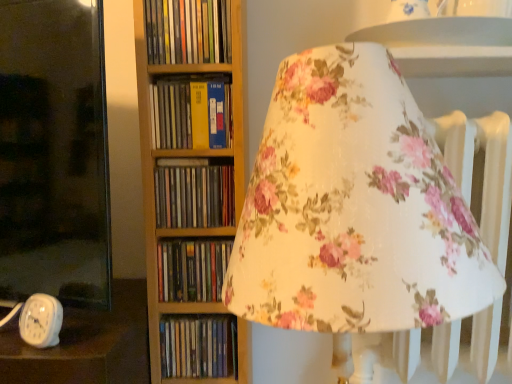
This screenshot has height=384, width=512. Identify the location of matte black book at center, positioned as the fourth book in top-to-bottom order. (192, 270).

Measure the distance between point (170, 284) and camera.

87.70 centimeters.

The image size is (512, 384). In order to click on brown cardboard book at center, which is the 3th book in top-to-bottom order in this screenshot , I will do `click(194, 196)`.

How much space does matte plastic books at center, arranged as the 1th book when ordered from the bottom, occupy vertically?

matte plastic books at center, arranged as the 1th book when ordered from the bottom, is 5.32 inches in height.

At what (x,y) coordinates should I click in order to perform the action: click on matte black book at center, positioned as the fourth book in top-to-bottom order. Please return your answer as a coordinate pair (x, y). This screenshot has width=512, height=384. Looking at the image, I should click on (192, 270).

From the image's perspective, does hardcover books at center, marked as the first book in a top-to-bottom arrangement, appear lower than yellow matte book at center, placed as the fourth book when sorted from bottom to top?

Actually, hardcover books at center, marked as the first book in a top-to-bottom arrangement, appears above yellow matte book at center, placed as the fourth book when sorted from bottom to top, in the image.

Considering the relative positions of hardcover books at center, marked as the first book in a top-to-bottom arrangement, and yellow matte book at center, placed as the fourth book when sorted from bottom to top, in the image provided, is hardcover books at center, marked as the first book in a top-to-bottom arrangement, behind yellow matte book at center, placed as the fourth book when sorted from bottom to top,?

No, it is not.

From a real-world perspective, is hardcover books at center, placed as the fifth book when sorted from bottom to top, physically above yellow matte book at center, which is the 2th book in top-to-bottom order?

Yes, from a real-world perspective, hardcover books at center, placed as the fifth book when sorted from bottom to top, is on top of yellow matte book at center, which is the 2th book in top-to-bottom order.

Considering the sizes of objects hardcover books at center, placed as the fifth book when sorted from bottom to top, and yellow matte book at center, placed as the fourth book when sorted from bottom to top, in the image provided, who is bigger, hardcover books at center, placed as the fifth book when sorted from bottom to top, or yellow matte book at center, placed as the fourth book when sorted from bottom to top,?

Bigger between the two is hardcover books at center, placed as the fifth book when sorted from bottom to top.

Who is shorter, brown cardboard book at center, placed as the third book when sorted from bottom to top, or yellow matte book at center, which is the 2th book in top-to-bottom order?

With less height is yellow matte book at center, which is the 2th book in top-to-bottom order.

Would you say brown cardboard book at center, placed as the third book when sorted from bottom to top, contains yellow matte book at center, which is the 2th book in top-to-bottom order?

Definitely not — yellow matte book at center, which is the 2th book in top-to-bottom order, is not inside brown cardboard book at center, placed as the third book when sorted from bottom to top.

Who is bigger, brown cardboard book at center, which is the 3th book in top-to-bottom order, or yellow matte book at center, which is the 2th book in top-to-bottom order?

Bigger between the two is brown cardboard book at center, which is the 3th book in top-to-bottom order.

Can you see brown cardboard book at center, which is the 3th book in top-to-bottom order, touching yellow matte book at center, which is the 2th book in top-to-bottom order?

No, brown cardboard book at center, which is the 3th book in top-to-bottom order, is not next to yellow matte book at center, which is the 2th book in top-to-bottom order.

Which object is positioned more to the left, yellow matte book at center, placed as the fourth book when sorted from bottom to top, or matte plastic books at center, placed as the fifth book when sorted from top to bottom?

yellow matte book at center, placed as the fourth book when sorted from bottom to top, is more to the left.

Is yellow matte book at center, which is the 2th book in top-to-bottom order, surrounding matte plastic books at center, arranged as the 1th book when ordered from the bottom?

No, matte plastic books at center, arranged as the 1th book when ordered from the bottom, is not inside yellow matte book at center, which is the 2th book in top-to-bottom order.

This screenshot has height=384, width=512. What are the coordinates of `the 3rd book in front when counting from the matte plastic books at center, arranged as the 1th book when ordered from the bottom` in the screenshot? It's located at (191, 114).

From a real-world perspective, is yellow matte book at center, which is the 2th book in top-to-bottom order, under matte plastic books at center, placed as the fifth book when sorted from top to bottom?

No, from a real-world perspective, yellow matte book at center, which is the 2th book in top-to-bottom order, is not under matte plastic books at center, placed as the fifth book when sorted from top to bottom.

Is yellow matte book at center, which is the 2th book in top-to-bottom order, taller or shorter than brown cardboard book at center, which is the 3th book in top-to-bottom order?

In the image, yellow matte book at center, which is the 2th book in top-to-bottom order, appears to be shorter than brown cardboard book at center, which is the 3th book in top-to-bottom order.

Is yellow matte book at center, placed as the fourth book when sorted from bottom to top, facing away from brown cardboard book at center, which is the 3th book in top-to-bottom order?

No.

Could you measure the distance between yellow matte book at center, placed as the fourth book when sorted from bottom to top, and brown cardboard book at center, which is the 3th book in top-to-bottom order?

The distance of yellow matte book at center, placed as the fourth book when sorted from bottom to top, from brown cardboard book at center, which is the 3th book in top-to-bottom order, is 10.21 centimeters.

Considering the sizes of yellow matte book at center, which is the 2th book in top-to-bottom order, and brown cardboard book at center, which is the 3th book in top-to-bottom order, in the image, is yellow matte book at center, which is the 2th book in top-to-bottom order, wider or thinner than brown cardboard book at center, which is the 3th book in top-to-bottom order,?

Clearly, yellow matte book at center, which is the 2th book in top-to-bottom order, has less width compared to brown cardboard book at center, which is the 3th book in top-to-bottom order.

Is hardcover books at center, marked as the first book in a top-to-bottom arrangement, inside yellow matte book at center, which is the 2th book in top-to-bottom order?

No.

Looking at this image, is the surface of yellow matte book at center, placed as the fourth book when sorted from bottom to top, in direct contact with hardcover books at center, marked as the first book in a top-to-bottom arrangement?

They are not placed beside each other.

Which of these two, yellow matte book at center, which is the 2th book in top-to-bottom order, or hardcover books at center, placed as the fifth book when sorted from bottom to top, is thinner?

yellow matte book at center, which is the 2th book in top-to-bottom order, is thinner.

Is yellow matte book at center, which is the 2th book in top-to-bottom order, closer to the viewer compared to hardcover books at center, marked as the first book in a top-to-bottom arrangement?

That is False.

Who is smaller, matte plastic books at center, arranged as the 1th book when ordered from the bottom, or matte black book at center, which ranks as the 2th book in bottom-to-top order?

matte black book at center, which ranks as the 2th book in bottom-to-top order, is smaller.

Does matte plastic books at center, arranged as the 1th book when ordered from the bottom, lie in front of matte black book at center, positioned as the fourth book in top-to-bottom order?

No, it is not.

Is matte plastic books at center, placed as the fifth book when sorted from top to bottom, facing away from matte black book at center, which ranks as the 2th book in bottom-to-top order?

matte plastic books at center, placed as the fifth book when sorted from top to bottom, is not turned away from matte black book at center, which ranks as the 2th book in bottom-to-top order.

Are matte plastic books at center, placed as the fifth book when sorted from top to bottom, and matte black book at center, positioned as the fourth book in top-to-bottom order, located far from each other?

No, matte plastic books at center, placed as the fifth book when sorted from top to bottom, is not far from matte black book at center, positioned as the fourth book in top-to-bottom order.

Considering the relative sizes of matte plastic books at center, arranged as the 1th book when ordered from the bottom, and brown cardboard book at center, which is the 3th book in top-to-bottom order, in the image provided, is matte plastic books at center, arranged as the 1th book when ordered from the bottom, bigger than brown cardboard book at center, which is the 3th book in top-to-bottom order,?

Incorrect, matte plastic books at center, arranged as the 1th book when ordered from the bottom, is not larger than brown cardboard book at center, which is the 3th book in top-to-bottom order.

Considering the positions of objects matte plastic books at center, arranged as the 1th book when ordered from the bottom, and brown cardboard book at center, which is the 3th book in top-to-bottom order, in the image provided, who is more to the left, matte plastic books at center, arranged as the 1th book when ordered from the bottom, or brown cardboard book at center, which is the 3th book in top-to-bottom order,?

brown cardboard book at center, which is the 3th book in top-to-bottom order, is more to the left.

From the brown cardboard book at center, placed as the third book when sorted from bottom to top, count 2nd book to the right and point to it. Please provide its 2D coordinates.

[(198, 346)]

Can you confirm if matte plastic books at center, placed as the fifth book when sorted from top to bottom, is wider than brown cardboard book at center, placed as the third book when sorted from bottom to top?

No.

Identify the location of the 1st book below the hardcover books at center, placed as the fifth book when sorted from bottom to top (from the image's perspective). Image resolution: width=512 pixels, height=384 pixels. (191, 114).

There is a brown cardboard book at center, which is the 3th book in top-to-bottom order. Identify the location of the 1st book above it (from the image's perspective). The image size is (512, 384). (191, 114).

Based on their spatial positions, is yellow matte book at center, placed as the fourth book when sorted from bottom to top, or hardcover books at center, marked as the first book in a top-to-bottom arrangement, further from brown cardboard book at center, which is the 3th book in top-to-bottom order?

hardcover books at center, marked as the first book in a top-to-bottom arrangement, is further to brown cardboard book at center, which is the 3th book in top-to-bottom order.

From the image, which object appears to be nearer to hardcover books at center, marked as the first book in a top-to-bottom arrangement, matte plastic books at center, placed as the fifth book when sorted from top to bottom, or brown cardboard book at center, placed as the third book when sorted from bottom to top?

brown cardboard book at center, placed as the third book when sorted from bottom to top.

Looking at the image, which one is located further to brown cardboard book at center, which is the 3th book in top-to-bottom order, matte plastic books at center, placed as the fifth book when sorted from top to bottom, or matte black book at center, positioned as the fourth book in top-to-bottom order?

matte plastic books at center, placed as the fifth book when sorted from top to bottom, is further to brown cardboard book at center, which is the 3th book in top-to-bottom order.

Consider the image. Considering their positions, is hardcover books at center, marked as the first book in a top-to-bottom arrangement, positioned further to matte plastic books at center, placed as the fifth book when sorted from top to bottom, than matte black book at center, which ranks as the 2th book in bottom-to-top order?

hardcover books at center, marked as the first book in a top-to-bottom arrangement, is positioned further to the anchor matte plastic books at center, placed as the fifth book when sorted from top to bottom.

From the image, which object appears to be farther from matte black book at center, positioned as the fourth book in top-to-bottom order, matte plastic books at center, placed as the fifth book when sorted from top to bottom, or hardcover books at center, placed as the fifth book when sorted from bottom to top?

hardcover books at center, placed as the fifth book when sorted from bottom to top, is positioned further to the anchor matte black book at center, positioned as the fourth book in top-to-bottom order.

Looking at the image, which one is located closer to yellow matte book at center, which is the 2th book in top-to-bottom order, hardcover books at center, placed as the fifth book when sorted from bottom to top, or brown cardboard book at center, placed as the third book when sorted from bottom to top?

Among the two, brown cardboard book at center, placed as the third book when sorted from bottom to top, is located nearer to yellow matte book at center, which is the 2th book in top-to-bottom order.

Estimate the real-world distances between objects in this image. Which object is closer to yellow matte book at center, placed as the fourth book when sorted from bottom to top, matte black book at center, which ranks as the 2th book in bottom-to-top order, or matte plastic books at center, arranged as the 1th book when ordered from the bottom?

matte black book at center, which ranks as the 2th book in bottom-to-top order, lies closer to yellow matte book at center, placed as the fourth book when sorted from bottom to top, than the other object.

Considering their positions, is matte black book at center, which ranks as the 2th book in bottom-to-top order, positioned further to hardcover books at center, marked as the first book in a top-to-bottom arrangement, than brown cardboard book at center, placed as the third book when sorted from bottom to top?

The object further to hardcover books at center, marked as the first book in a top-to-bottom arrangement, is matte black book at center, which ranks as the 2th book in bottom-to-top order.

Find the location of a particular element. This screenshot has height=384, width=512. book between yellow matte book at center, placed as the fourth book when sorted from bottom to top, and matte black book at center, which ranks as the 2th book in bottom-to-top order, vertically is located at coordinates click(x=194, y=196).

Identify the location of book between hardcover books at center, placed as the fifth book when sorted from bottom to top, and brown cardboard book at center, which is the 3th book in top-to-bottom order, in the vertical direction. (191, 114).

Find the location of `book between brown cardboard book at center, which is the 3th book in top-to-bottom order, and matte plastic books at center, placed as the fifth book when sorted from top to bottom, in the vertical direction`. book between brown cardboard book at center, which is the 3th book in top-to-bottom order, and matte plastic books at center, placed as the fifth book when sorted from top to bottom, in the vertical direction is located at coordinates (192, 270).